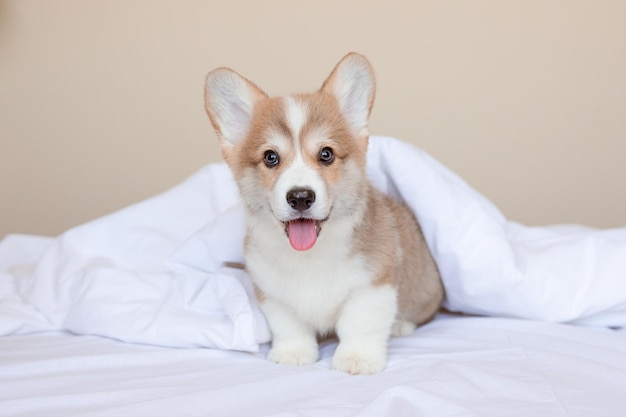
Find the location of a particular element. The width and height of the screenshot is (626, 417). covers is located at coordinates (473, 383), (484, 242), (140, 251).